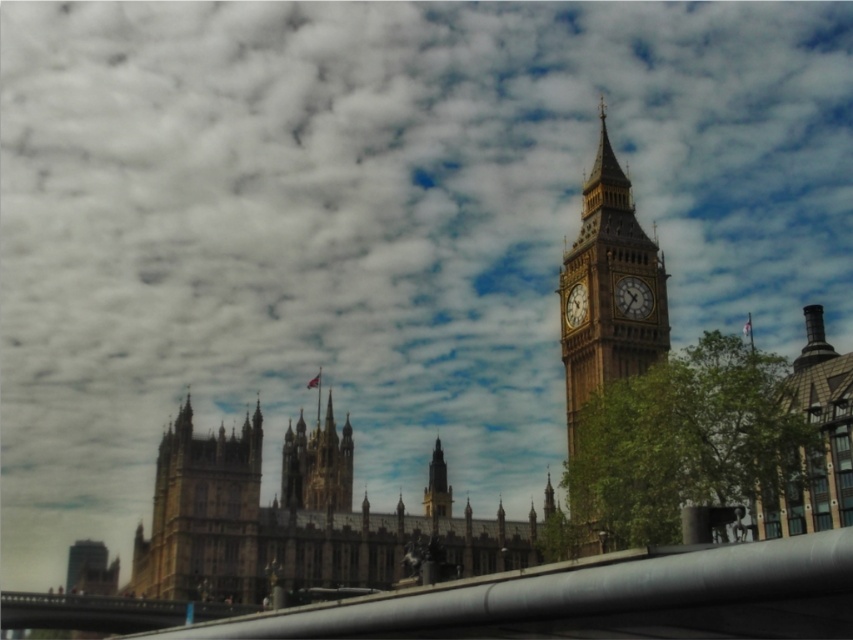
You are standing in a park and see the brown stone clock tower at right and the brown stone building at right. Which one is closer to you?

The brown stone clock tower at right is closer to you than the brown stone building at right.

In the scene shown: You are a tourist standing in front of the brown stone building at center and the gold metallic clock at right. Which object is closer to the ground?

The brown stone building at center is closer to the ground because it is located below the gold metallic clock at right.

You are a tourist standing at the base of the brown stone building at center in the image of Big Ben and the Palace of Westminster. If you were to look directly ahead, which direction would you be facing relative to the building?

Since the brown stone building at center is positioned at the center of the image, facing directly ahead would mean looking towards the front of the building, which aligns with the direction the clock face of Big Ben is facing. However, the exact direction depends on the orientation of the image, but based on typical viewpoints, facing the building would generally mean looking northwards towards the Thames River.